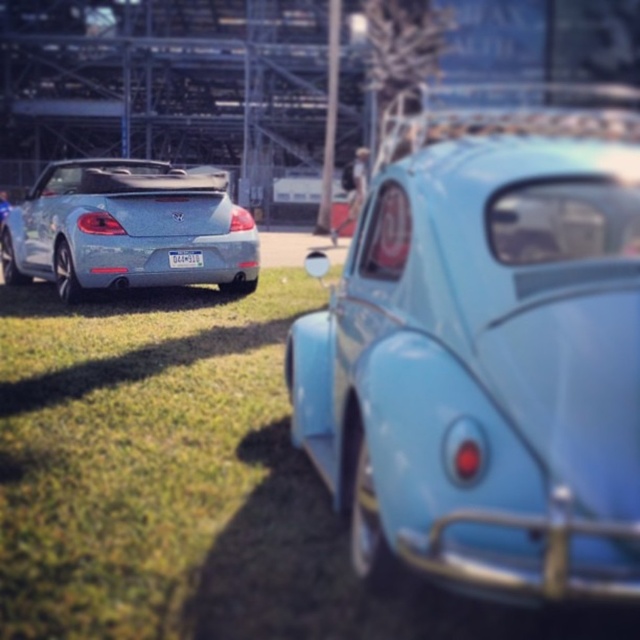
Which of these two, light blue matte car at center or white plastic license plate at rear, stands taller?

Standing taller between the two is light blue matte car at center.

Can you confirm if light blue matte car at center is positioned to the left of white plastic license plate at rear?

No, light blue matte car at center is not to the left of white plastic license plate at rear.

Between point (596, 509) and point (195, 259), which one is positioned in front?

Positioned in front is point (596, 509).

Where is `light blue matte car at center`? The height and width of the screenshot is (640, 640). light blue matte car at center is located at coordinates (484, 371).

Is satin silver convertible at left below white plastic license plate at rear?

Actually, satin silver convertible at left is above white plastic license plate at rear.

From the picture: Is satin silver convertible at left further to camera compared to white plastic license plate at rear?

Yes, satin silver convertible at left is further from the viewer.

The image size is (640, 640). I want to click on satin silver convertible at left, so click(x=128, y=228).

Looking at this image, can you confirm if light blue matte car at center is shorter than satin silver convertible at left?

In fact, light blue matte car at center may be taller than satin silver convertible at left.

Is point (513, 536) positioned behind point (154, 176)?

No, it is not.

Does point (380, 486) come farther from viewer compared to point (125, 220)?

No, it is not.

The width and height of the screenshot is (640, 640). What are the coordinates of `light blue matte car at center` in the screenshot? It's located at (484, 371).